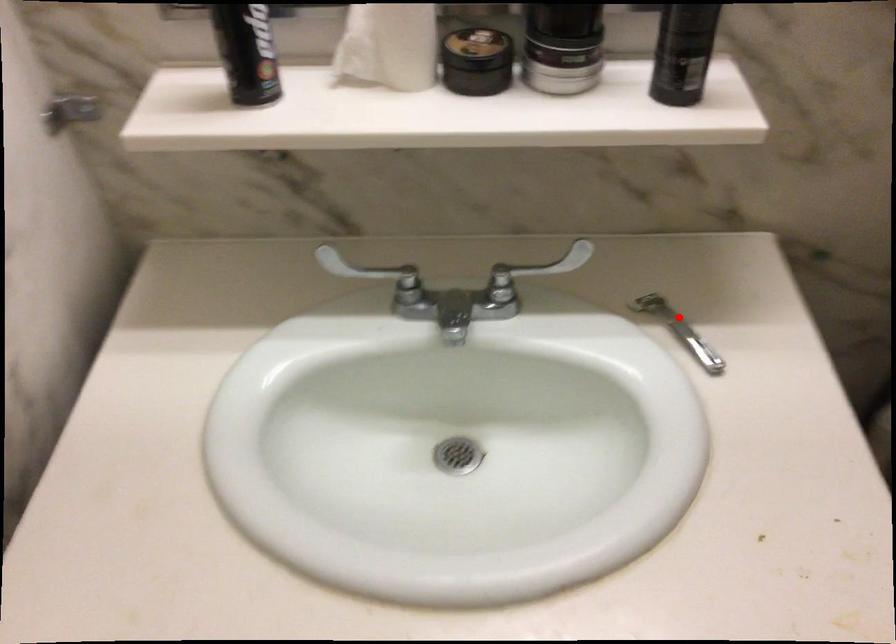
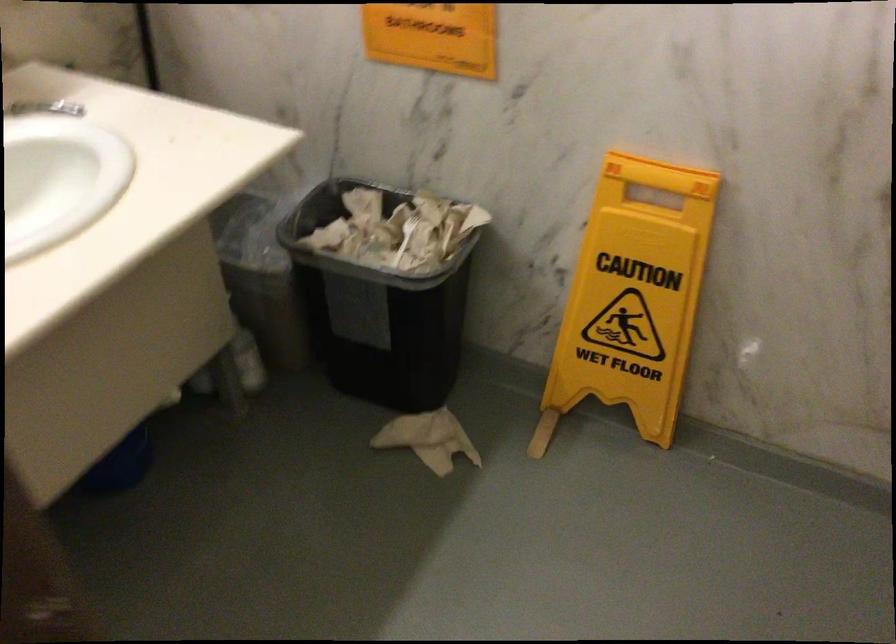
Question: A red point is marked in image1. In image2, is the corresponding 3D point closer to the camera or farther? Reply with the corresponding letter.

Choices:
 (A) The corresponding 3D point is closer.
 (B) The corresponding 3D point is farther.

Answer: (B)